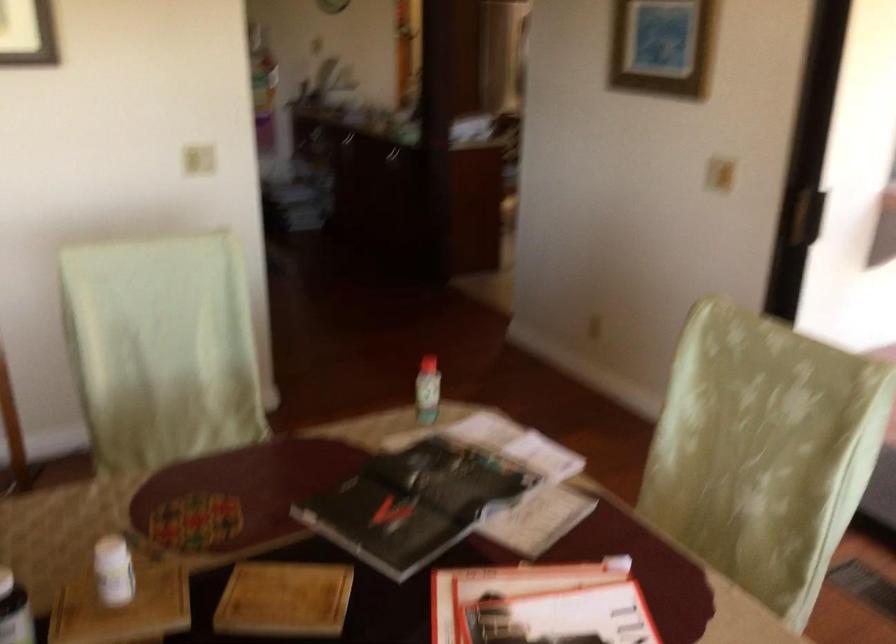
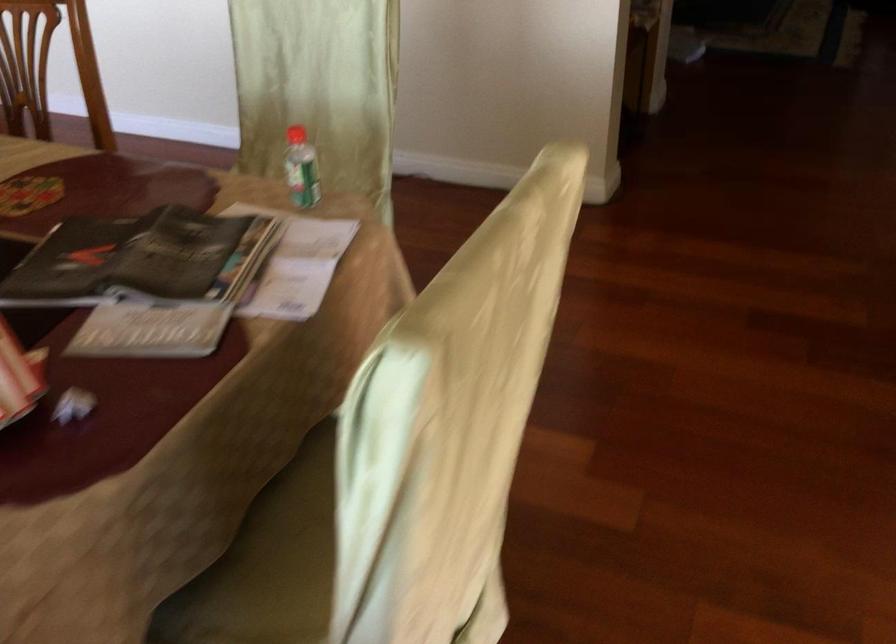
Find the pixel in the second image that matches point 432,366 in the first image.

(296, 135)